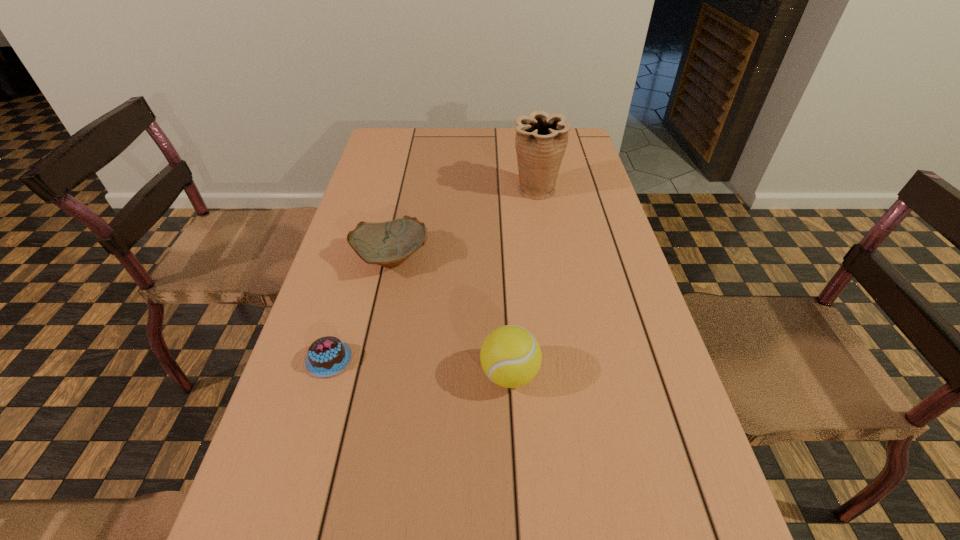
The height and width of the screenshot is (540, 960). I want to click on empty space that is in between the shortest object and the tennis ball, so click(x=420, y=367).

Identify the location of vacant area between the third tallest object and the urn. (464, 225).

Image resolution: width=960 pixels, height=540 pixels. Identify the location of free area in between the chocolate cake and the pottery. (360, 309).

This screenshot has width=960, height=540. I want to click on free space between the shortest object and the pottery, so click(360, 309).

I want to click on free space between the chocolate cake and the tennis ball, so click(420, 367).

The width and height of the screenshot is (960, 540). Identify the location of unoccupied area between the second farthest object and the farthest object. (464, 225).

Locate an element on the screen. Image resolution: width=960 pixels, height=540 pixels. vacant region between the second shortest object and the shortest object is located at coordinates (360, 309).

Where is `free spot between the farthest object and the tennis ball`? The height and width of the screenshot is (540, 960). free spot between the farthest object and the tennis ball is located at coordinates (522, 282).

This screenshot has height=540, width=960. What are the coordinates of `object that is the third closest to the third nearest object` in the screenshot? It's located at (541, 139).

Locate which object ranks second in proximity to the chocolate cake. Please provide its 2D coordinates. Your answer should be formatted as a tuple, i.e. [(x, y)], where the tuple contains the x and y coordinates of a point satisfying the conditions above.

[(510, 356)]